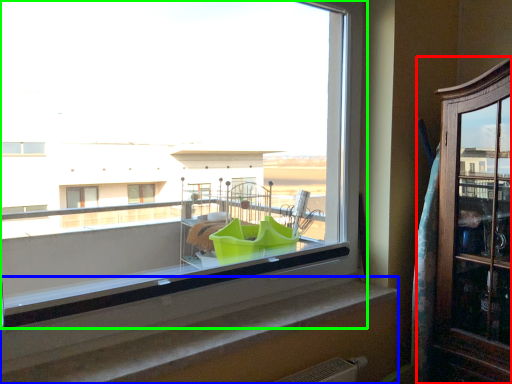
Question: Estimate the real-world distances between objects in this image. Which object is closer to dresser (highlighted by a red box), window sill (highlighted by a blue box) or window (highlighted by a green box)?

Choices:
 (A) window sill
 (B) window

Answer: (A)